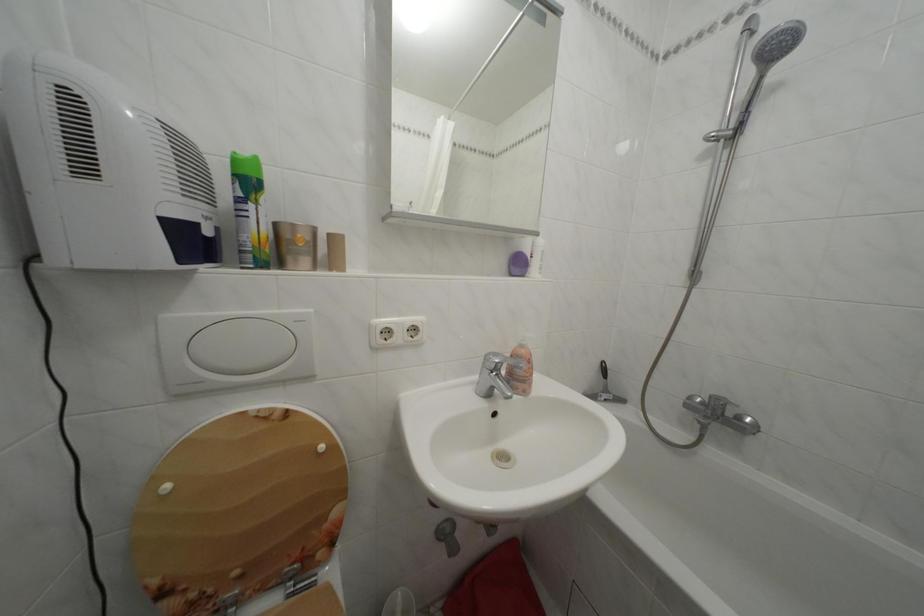
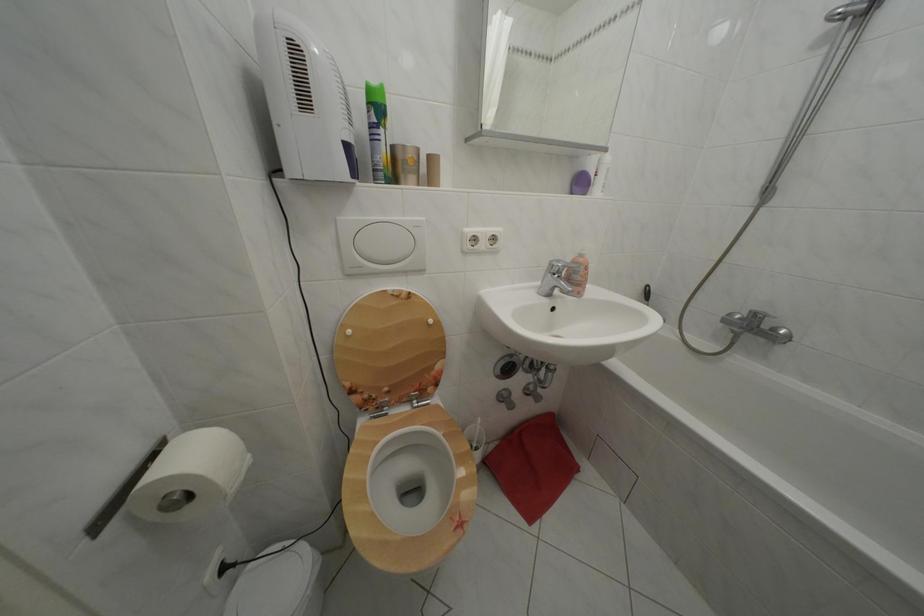
Find the pixel in the second image that matches pixel 242 182 in the first image.

(378, 110)